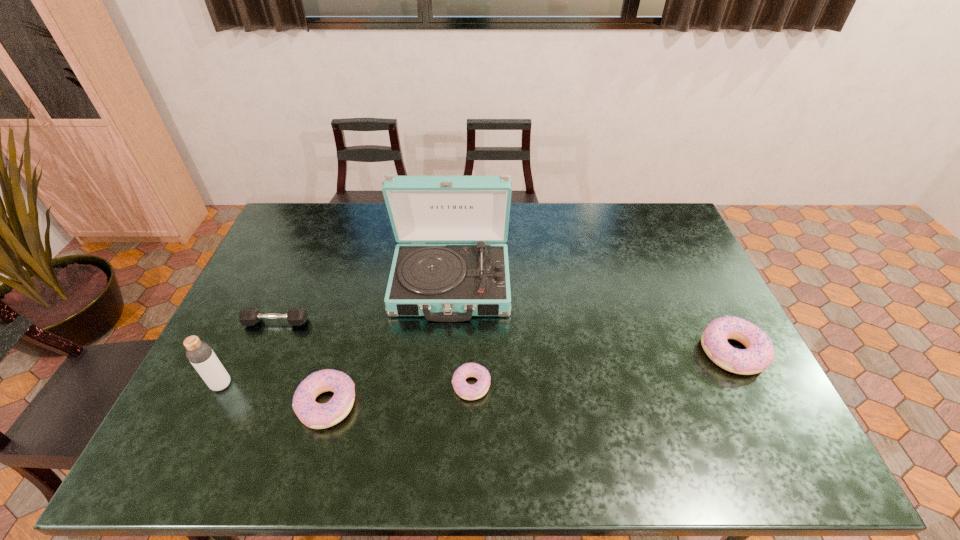
The image size is (960, 540). Identify the location of free region at the near edge. (523, 405).

Find the location of `vacant space at the left edge`. vacant space at the left edge is located at coordinates (228, 332).

This screenshot has width=960, height=540. In the image, there is a desktop. Identify the location of free space at the right edge. (686, 278).

You are a GUI agent. You are given a task and a screenshot of the screen. Output one action in this format:
    pyautogui.click(x=<x>, y=<y>)
    Task: Click on the free space at the far left corner of the desktop
    The image size is (960, 540).
    Given the screenshot: What is the action you would take?
    pyautogui.click(x=307, y=234)

Find the location of a particular element. blank region between the bottle and the record player is located at coordinates (336, 334).

This screenshot has width=960, height=540. In order to click on free space between the fourth object from right to left and the second doughnut from right to left in this screenshot , I will do `click(399, 395)`.

What are the coordinates of `free space between the second tallest doughnut and the tallest object` in the screenshot? It's located at (389, 343).

The width and height of the screenshot is (960, 540). In order to click on unoccupied area between the second doughnut from left to right and the dumbbell in this screenshot , I will do click(373, 354).

The width and height of the screenshot is (960, 540). I want to click on vacant region between the shortest object and the dumbbell, so click(x=373, y=354).

In order to click on unoccupied position between the rightmost object and the dumbbell in this screenshot , I will do `click(504, 337)`.